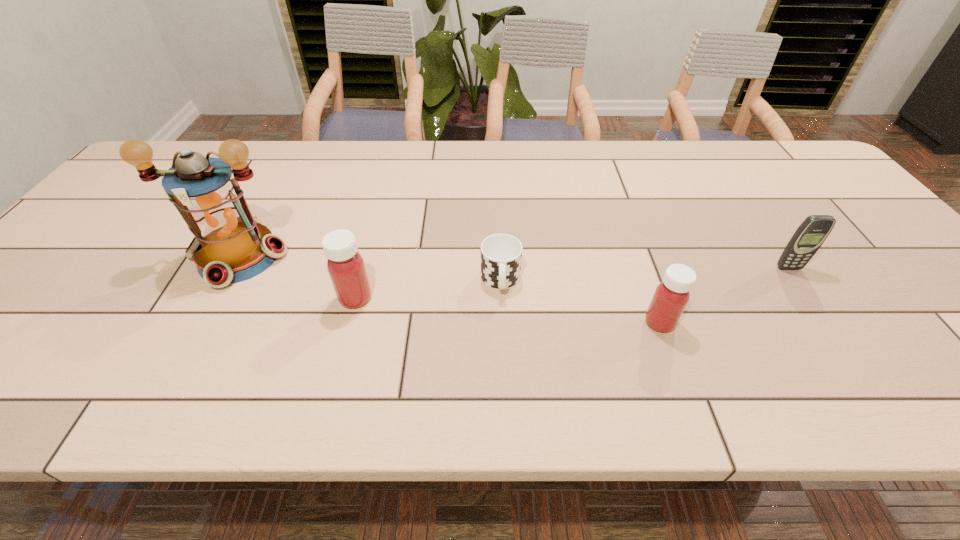
Find the location of a particular element. the fourth object from right to left is located at coordinates (345, 265).

You are a GUI agent. You are given a task and a screenshot of the screen. Output one action in this format:
    pyautogui.click(x=<x>, y=<y>)
    Task: Click on the right medicine
    The height and width of the screenshot is (540, 960).
    Given the screenshot: What is the action you would take?
    pyautogui.click(x=671, y=296)

The image size is (960, 540). Find the location of `the shorter medicine`. the shorter medicine is located at coordinates 671,296.

This screenshot has height=540, width=960. In order to click on cellular telephone in this screenshot , I will do [x=813, y=231].

The height and width of the screenshot is (540, 960). Find the location of `the third object from left to right`. the third object from left to right is located at coordinates (501, 254).

Identify the location of the shortest object. The height and width of the screenshot is (540, 960). (501, 254).

Locate an element on the screen. The width and height of the screenshot is (960, 540). lantern is located at coordinates (230, 245).

Where is `the tallest object`? This screenshot has width=960, height=540. the tallest object is located at coordinates (230, 245).

The height and width of the screenshot is (540, 960). Find the location of `vacant space located 0.270m on the right of the fourth object from right to left`. vacant space located 0.270m on the right of the fourth object from right to left is located at coordinates (492, 298).

Find the location of a particular element. The image size is (960, 540). vacant area located 0.100m on the back of the second object from right to left is located at coordinates (643, 278).